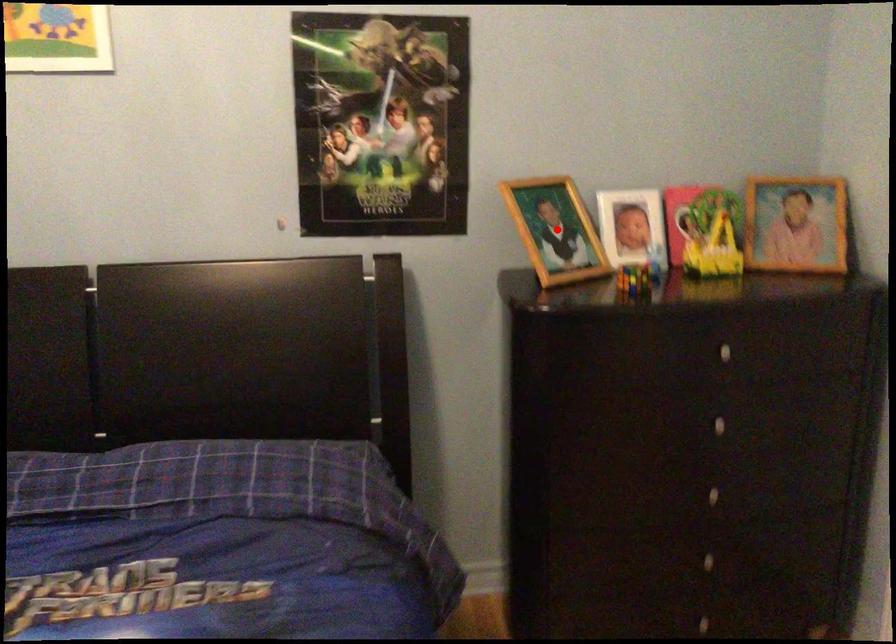
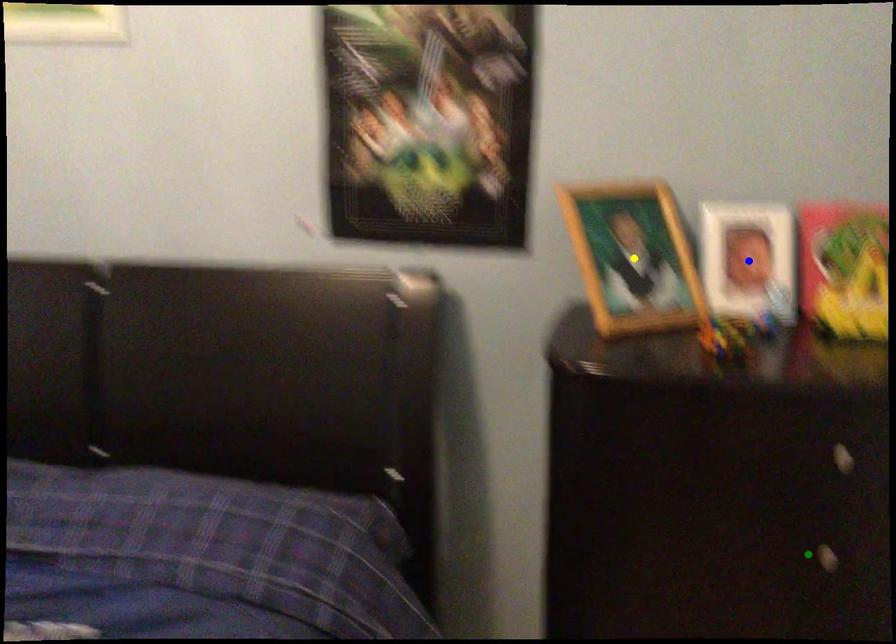
Question: I am providing you with two images of the same scene from different viewpoints. A red point is marked on the first image. You are given multiple points on the second image. Which point in image 2 is actually the same real-world point as the red point in image 1?

Choices:
 (A) yellow point
 (B) blue point
 (C) green point

Answer: (A)